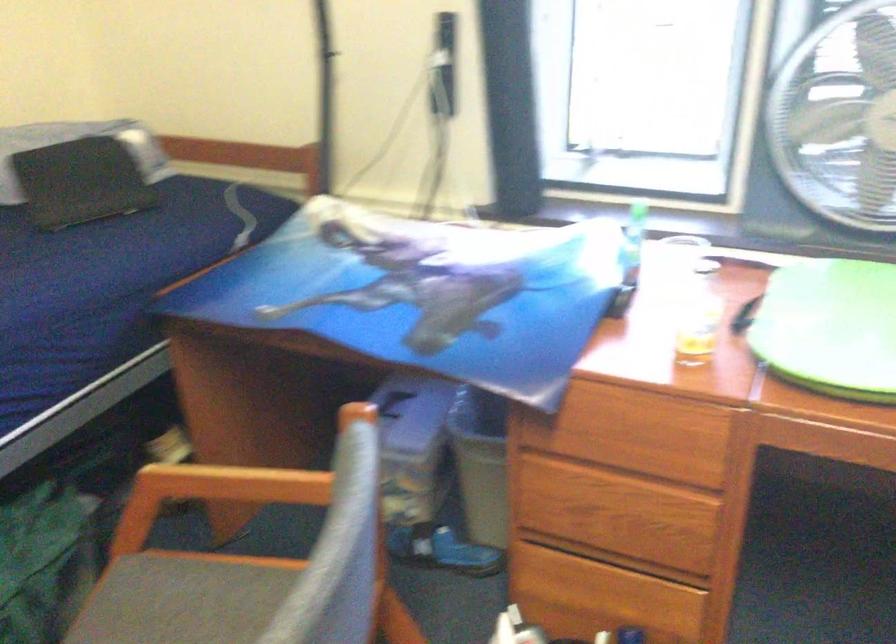
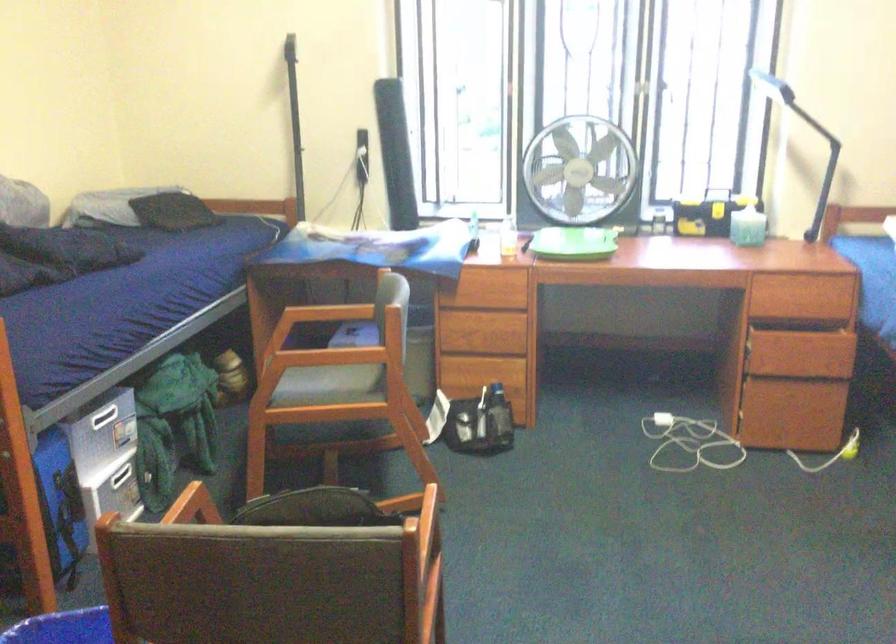
The images are taken continuously from a first-person perspective. In which direction are you moving?

The movement direction of the cameraman is left, backward.